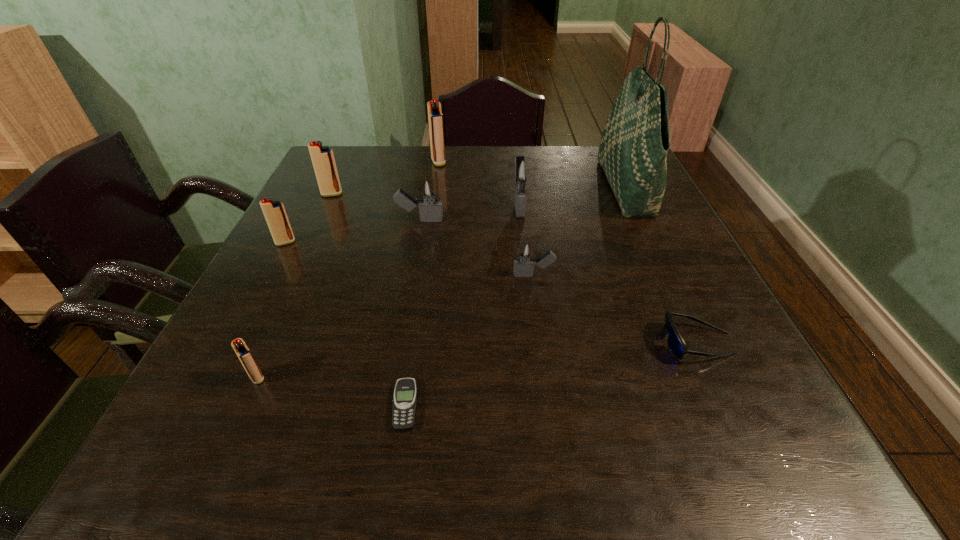
The width and height of the screenshot is (960, 540). I want to click on igniter that stands as the second closest to the third nearest object, so click(x=522, y=172).

Point out which igniter is positioned as the second nearest to the second biggest red igniter. Please provide its 2D coordinates. Your answer should be formatted as a tuple, i.e. [(x, y)], where the tuple contains the x and y coordinates of a point satisfying the conditions above.

[(274, 212)]

In order to click on the third closest red igniter to the leftmost gray igniter in this screenshot , I will do `click(435, 117)`.

Select which red igniter appears as the second closest to the leftmost igniter. Please provide its 2D coordinates. Your answer should be formatted as a tuple, i.e. [(x, y)], where the tuple contains the x and y coordinates of a point satisfying the conditions above.

[(245, 356)]

Where is `gray igniter that is the closest to the rightmost red igniter`? The height and width of the screenshot is (540, 960). gray igniter that is the closest to the rightmost red igniter is located at coordinates [x=522, y=172].

You are a GUI agent. You are given a task and a screenshot of the screen. Output one action in this format:
    pyautogui.click(x=<x>, y=<y>)
    Task: Click on the gray igniter identified as the third closest to the beeper
    The height and width of the screenshot is (540, 960).
    Given the screenshot: What is the action you would take?
    pyautogui.click(x=522, y=172)

Where is `free region that satisfies the following two spatial constraints: 1. on the front side of the green tote bag; 2. on the front-facing side of the ninth tallest object`? This screenshot has height=540, width=960. free region that satisfies the following two spatial constraints: 1. on the front side of the green tote bag; 2. on the front-facing side of the ninth tallest object is located at coordinates (698, 343).

This screenshot has width=960, height=540. I want to click on free space that satisfies the following two spatial constraints: 1. on the back side of the third nearest igniter; 2. on the left side of the tallest object, so click(315, 188).